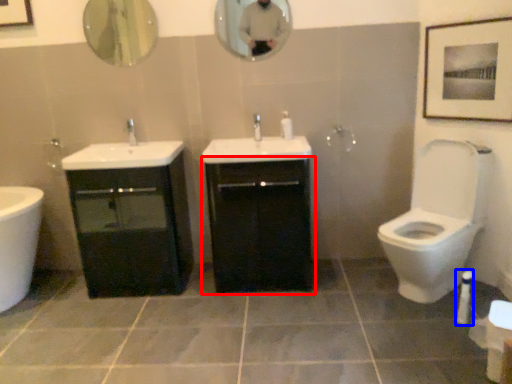
Question: Which object appears farthest to the camera in this image, bathroom cabinet (highlighted by a red box) or toiletry (highlighted by a blue box)?

Choices:
 (A) bathroom cabinet
 (B) toiletry

Answer: (A)